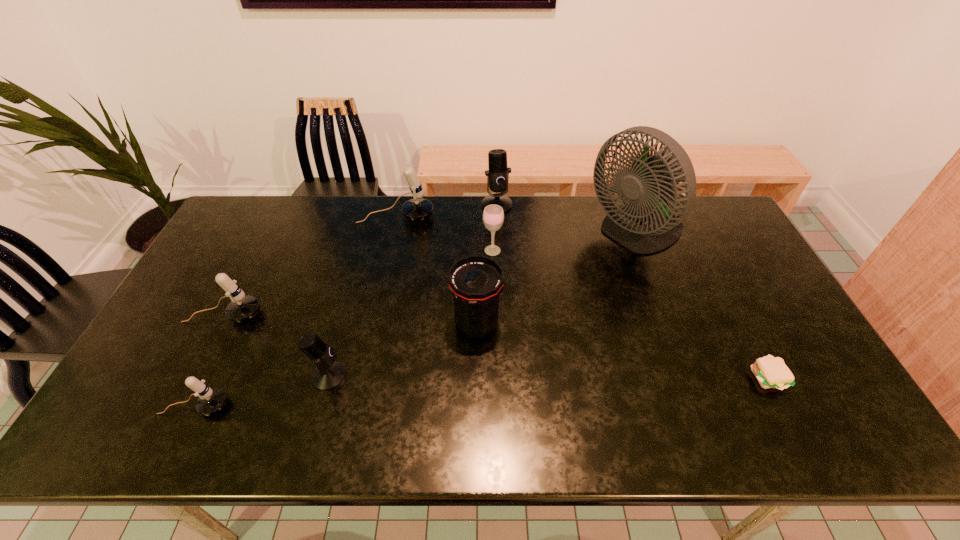
This screenshot has height=540, width=960. In order to click on the tallest object in this screenshot , I will do `click(647, 224)`.

Where is `fan`? The width and height of the screenshot is (960, 540). fan is located at coordinates (647, 224).

In order to click on the farther black microphone in this screenshot , I will do `click(498, 174)`.

I want to click on the bigger black microphone, so click(498, 174).

Find the location of a particular element. the rightmost white microphone is located at coordinates (416, 209).

You are a GUI agent. You are given a task and a screenshot of the screen. Output one action in this format:
    pyautogui.click(x=<x>, y=<y>)
    Task: Click on the farthest white microphone
    The width and height of the screenshot is (960, 540).
    Given the screenshot: What is the action you would take?
    pyautogui.click(x=416, y=209)

The image size is (960, 540). Find the location of `telephoto lens`. telephoto lens is located at coordinates (476, 282).

I want to click on wineglass, so click(493, 216).

At what (x,y) coordinates should I click in order to perform the action: click on the second biggest white microphone. Please return your answer as a coordinate pair (x, y). Looking at the image, I should click on (241, 308).

Where is `the third farthest microphone`? The height and width of the screenshot is (540, 960). the third farthest microphone is located at coordinates (241, 308).